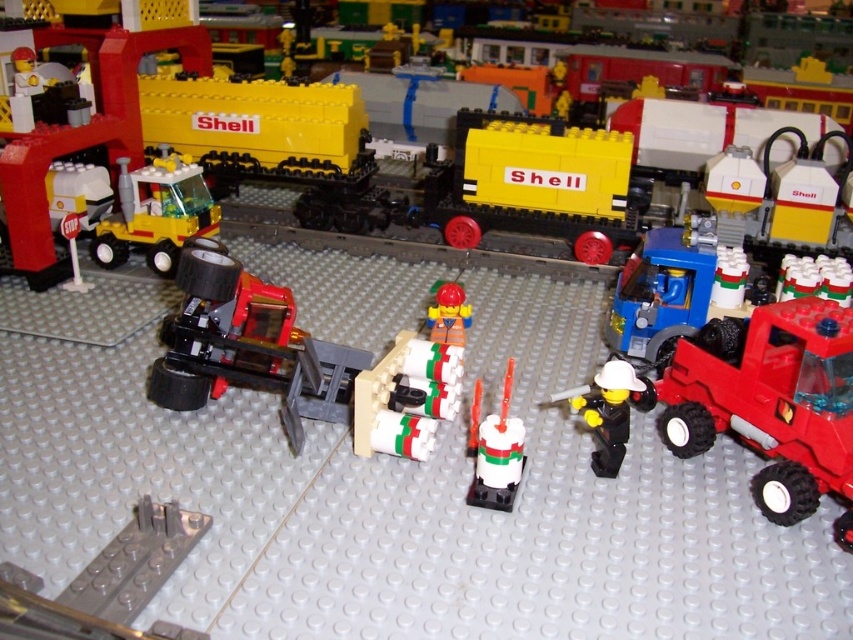
You are standing in front of the Lego diorama and want to place a small Lego figure between the two points marked as point (834, 337) and point (456, 344). Which point should the figure be closer to in order to be nearer to the viewer?

The figure should be placed closer to point (834, 337) because it is closer to the viewer than point (456, 344).

You are a drone operator trying to position your drone to capture a closeup of the white glossy candle at center. The drone must stay within the boundaries of the Lego diorama. Given the candle is at coordinates point 0.705, 0.581, can you confirm if this position is within the diorama?

The white glossy candle at center is located at point (495, 451), which is within the Lego diorama boundaries, so yes, the drone can safely position itself there for the closeup.

You are a toy collector who wants to place the rubberized red truck at right and the white glossy candle at center on a shelf. Which object should you place first to ensure they both fit vertically?

The rubberized red truck at right is taller than the white glossy candle at center, so you should place the rubberized red truck at right first to ensure there is enough vertical space for both items.